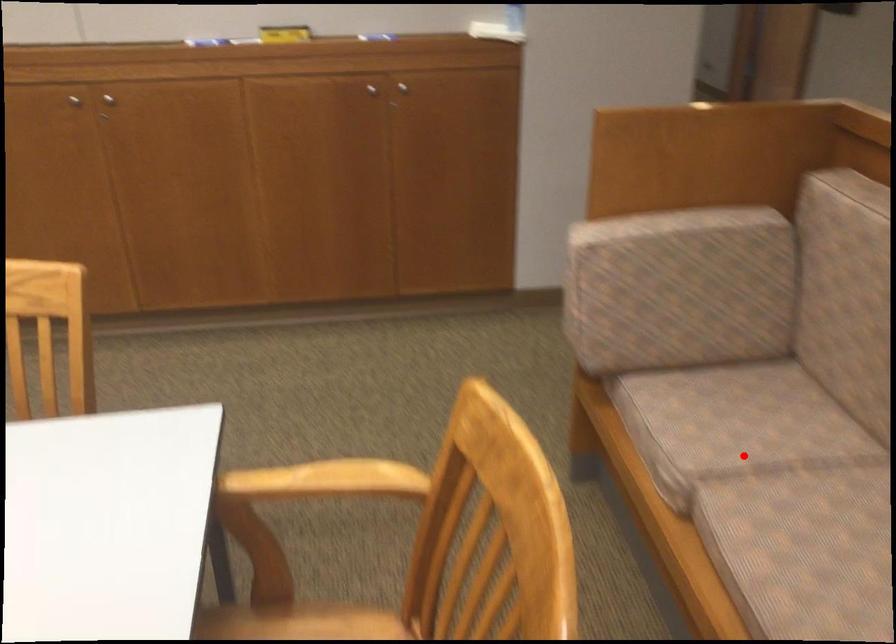
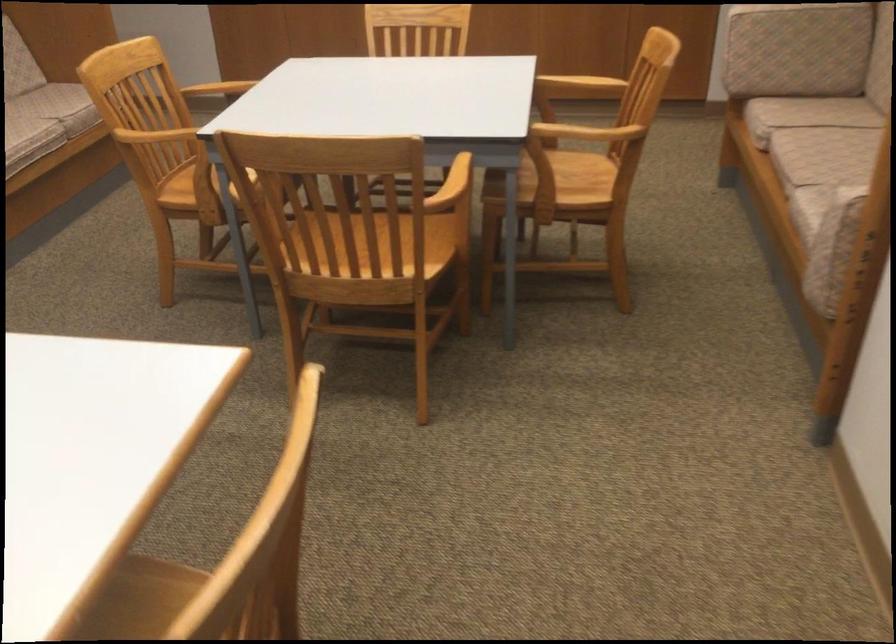
Locate, in the second image, the point that corresponds to the highlighted location in the first image.

(807, 114)